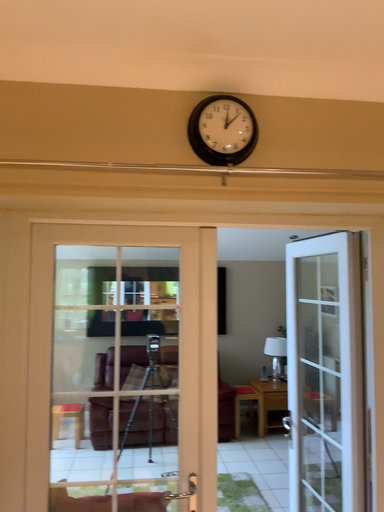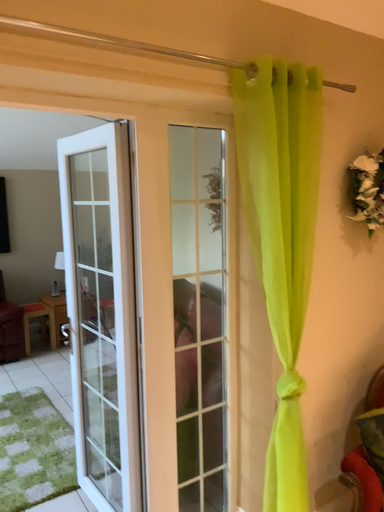
Question: How did the camera likely rotate when shooting the video?

Choices:
 (A) rotated left
 (B) rotated right

Answer: (B)